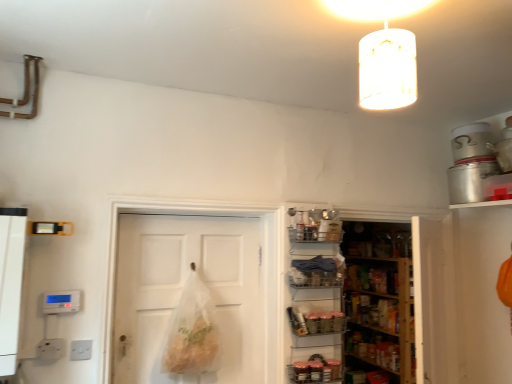
Question: Does point (317, 365) appear closer or farther from the camera than point (375, 1)?

Choices:
 (A) farther
 (B) closer

Answer: (A)

Question: Visually, is shiny metallic jars at center positioned to the left or to the right of translucent white cylinder at upper center?

Choices:
 (A) right
 (B) left

Answer: (B)

Question: Based on their relative distances, which object is farther from the metallic wire basket at center, positioned as the first shelf in bottom-to-top order?

Choices:
 (A) white matte door at center
 (B) wooden shelves at center
 (C) translucent white cylinder at upper center
 (D) metallic wire basket at center, arranged as the first shelf when viewed from the top
 (E) shiny metallic jars at center

Answer: (C)

Question: Which is nearer to the white matte door at center?

Choices:
 (A) shiny metallic jars at center
 (B) wooden shelves at center
 (C) translucent white cylinder at upper center
 (D) metallic wire basket at center, arranged as the first shelf when viewed from the top
 (E) metallic wire basket at center, positioned as the first shelf in bottom-to-top order

Answer: (E)